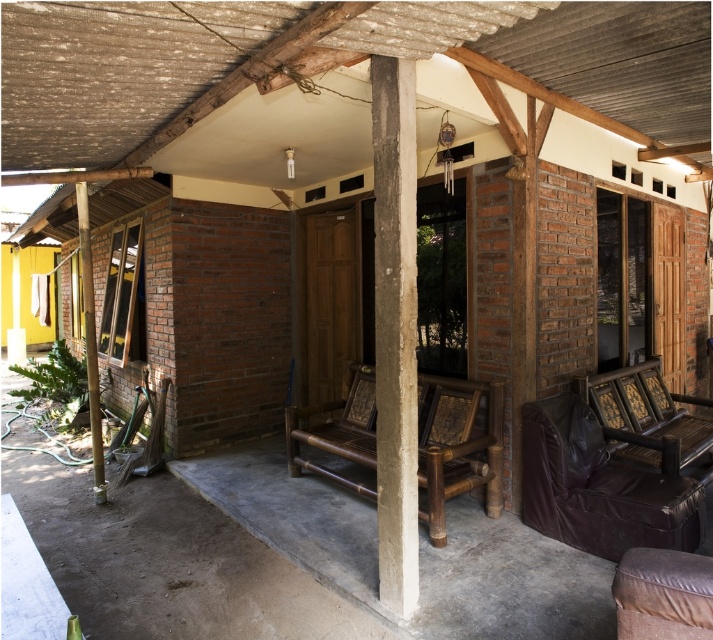
Is point (414, 60) positioned behind point (366, 442)?

No.

Does concrete at center come behind brown wooden bench at center?

No, it is not.

Which is behind, point (391, 348) or point (334, 404)?

The point (334, 404) is more distant.

Image resolution: width=713 pixels, height=640 pixels. Identify the location of concrete at center. (394, 330).

Who is higher up, brown leather armchair at center or brown wooden armchair at lower right?

Positioned higher is brown wooden armchair at lower right.

Can you confirm if brown leather armchair at center is bigger than brown wooden armchair at lower right?

No.

The image size is (713, 640). What are the coordinates of `brown leather armchair at center` in the screenshot? It's located at (600, 484).

Which of these two, concrete at center or brown wooden armchair at lower right, stands taller?

Standing taller between the two is concrete at center.

Does point (376, 400) lie in front of point (620, 448)?

Yes, it is.

In order to click on concrete at center in this screenshot , I will do `click(394, 330)`.